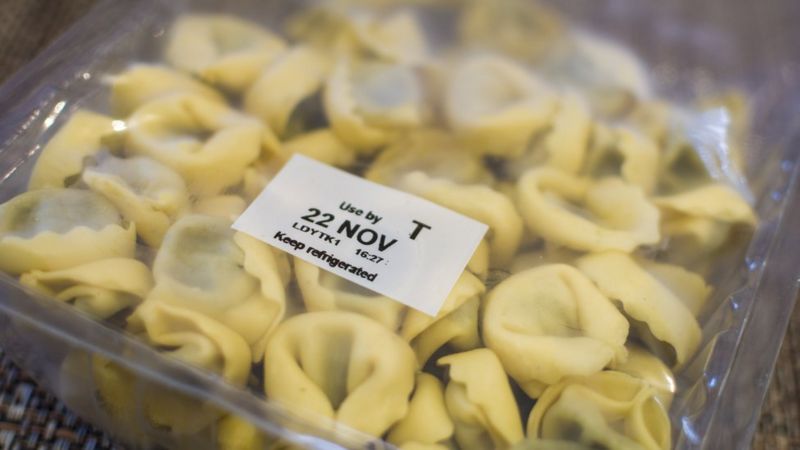
You are a GUI agent. You are given a task and a screenshot of the screen. Output one action in this format:
    pyautogui.click(x=<x>, y=<y>)
    Task: Click on the white sticker
    
    Given the screenshot: What is the action you would take?
    pyautogui.click(x=392, y=220)